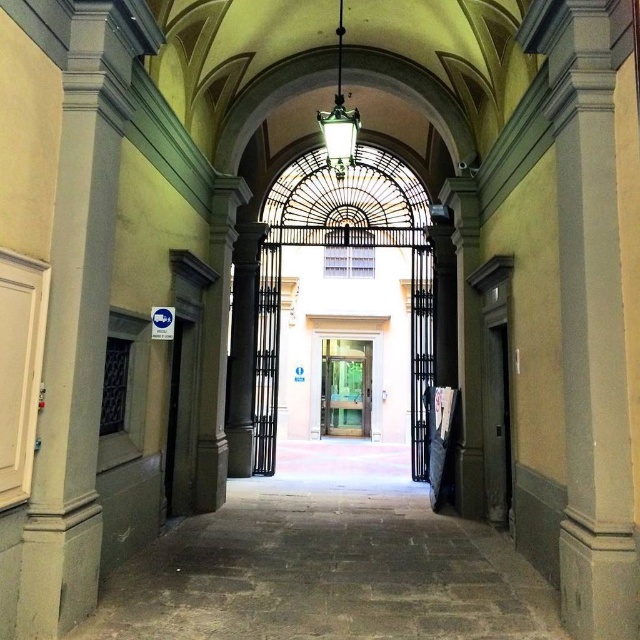
Question: Is dark gray wooden door at right positioned behind clear glass door at center?

Choices:
 (A) no
 (B) yes

Answer: (A)

Question: Considering the relative positions of dark gray wooden door at right and clear glass door at center in the image provided, where is dark gray wooden door at right located with respect to clear glass door at center?

Choices:
 (A) below
 (B) above

Answer: (B)

Question: Which point is closer to the camera?

Choices:
 (A) dark gray wooden door at right
 (B) clear glass door at center

Answer: (A)

Question: Does dark gray wooden door at right appear under clear glass door at center?

Choices:
 (A) yes
 (B) no

Answer: (B)

Question: Which point is closer to the camera?

Choices:
 (A) (493, 436)
 (B) (356, 385)

Answer: (A)